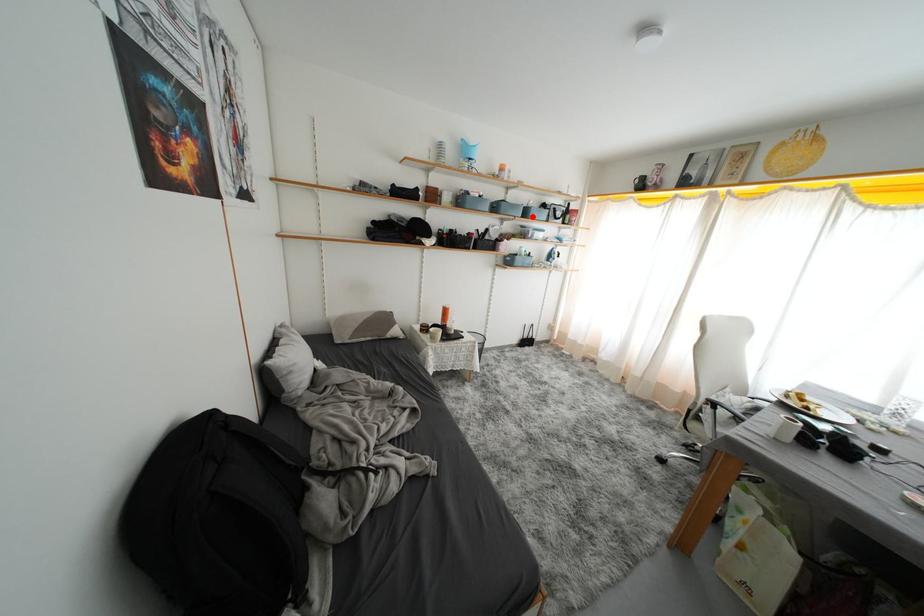
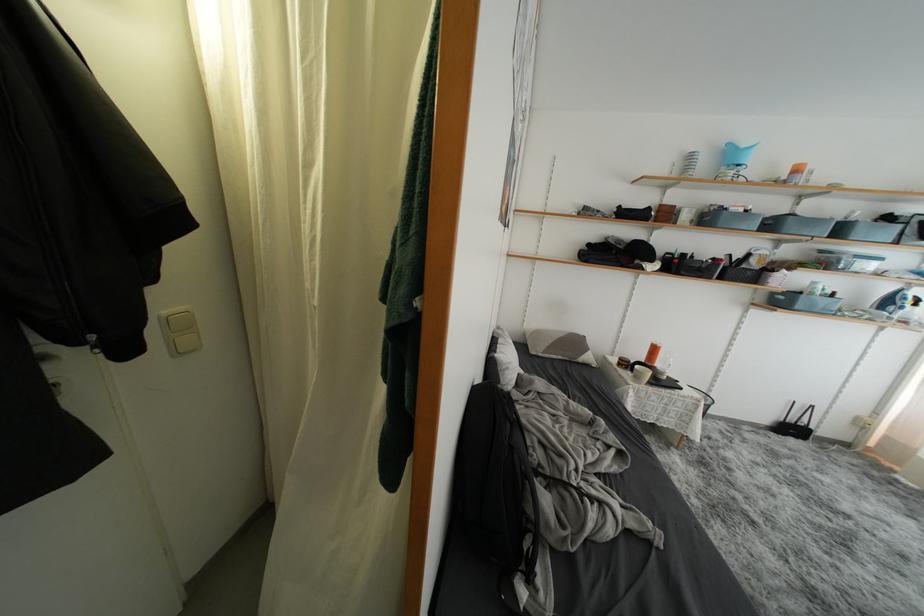
Question: I am providing you with two images of the same scene from different viewpoints. Image1 has a red point marked. In image2, the corresponding 3D location appears at what relative position? Reply with the corresponding letter.

Choices:
 (A) Closer
 (B) Farther

Answer: (B)